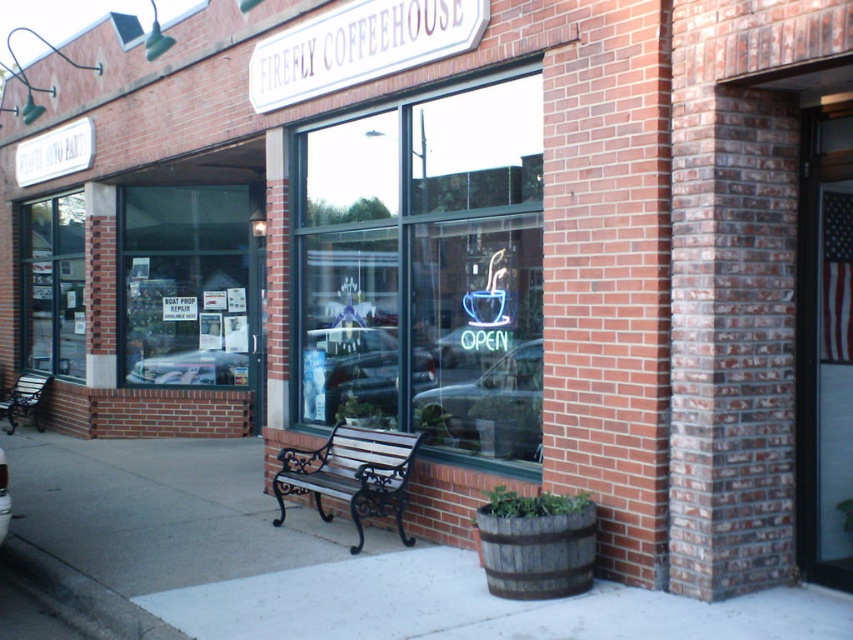
Can you confirm if neon glass window at center is shorter than wooden bench at center?

→ No.

Which is behind, point (465, 289) or point (409, 435)?

The point (409, 435) is more distant.

I want to click on neon glass window at center, so click(x=426, y=269).

Which of these two, smooth concrete pavement at center or transparent glass window at left, stands shorter?

With less height is smooth concrete pavement at center.

Between smooth concrete pavement at center and transparent glass window at left, which one appears on the right side from the viewer's perspective?

smooth concrete pavement at center

Is point (42, 512) farther from camera compared to point (39, 324)?

No, (42, 512) is in front of (39, 324).

Image resolution: width=853 pixels, height=640 pixels. I want to click on smooth concrete pavement at center, so click(x=310, y=561).

Can you confirm if clear glass window at center is shorter than transparent glass window at left?

No, clear glass window at center is not shorter than transparent glass window at left.

Between point (218, 250) and point (78, 346), which one is positioned in front?

Point (218, 250)

Who is more distant from viewer, (178, 307) or (28, 324)?

The point (28, 324) is more distant.

Locate an element on the screen. Image resolution: width=853 pixels, height=640 pixels. clear glass window at center is located at coordinates (184, 284).